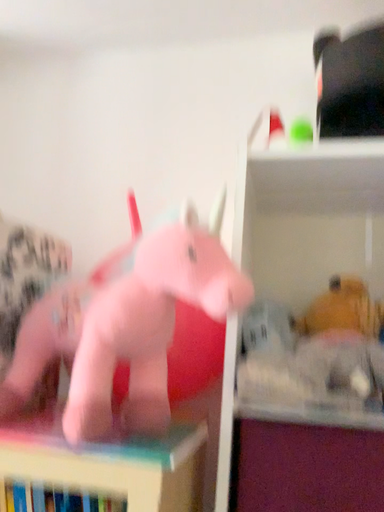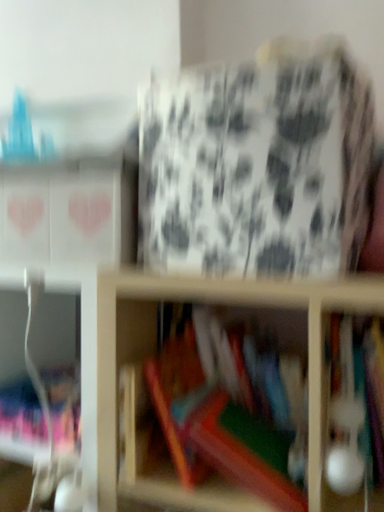
Question: How did the camera likely rotate when shooting the video?

Choices:
 (A) rotated upward
 (B) rotated downward

Answer: (B)